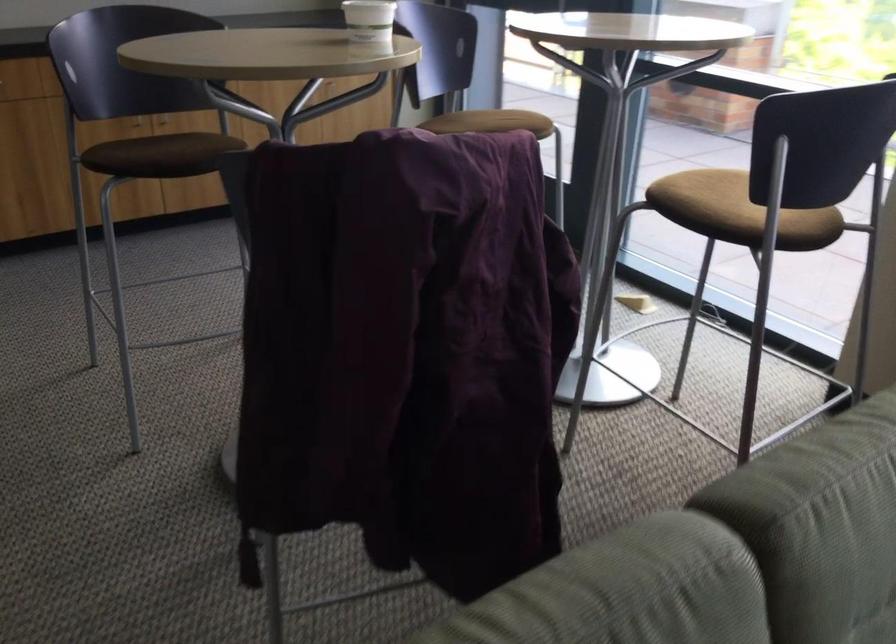
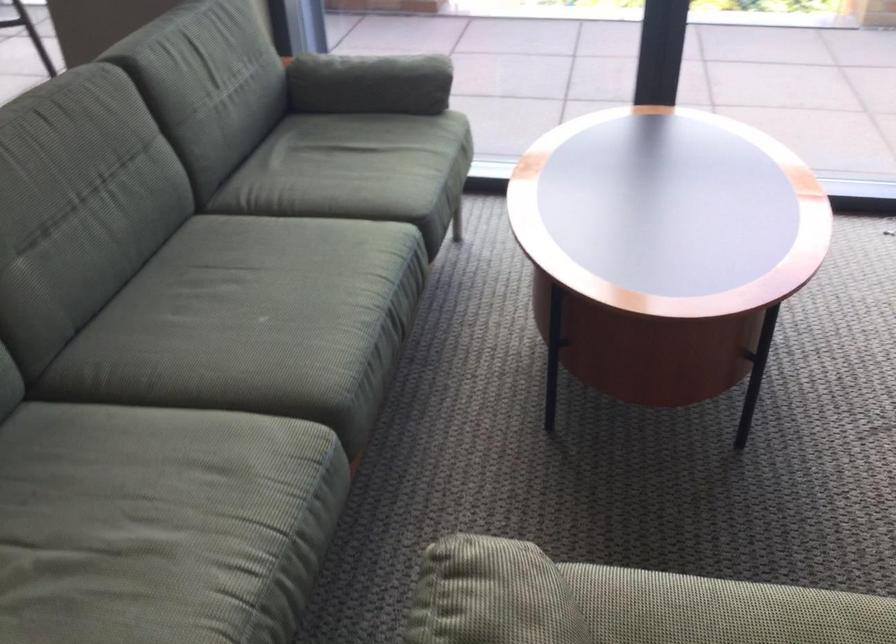
Question: The camera is either moving clockwise (left) or counter-clockwise (right) around the object. The first image is from the beginning of the video and the second image is from the end. Is the camera moving left or right when shooting the video?

Choices:
 (A) Left
 (B) Right

Answer: (A)